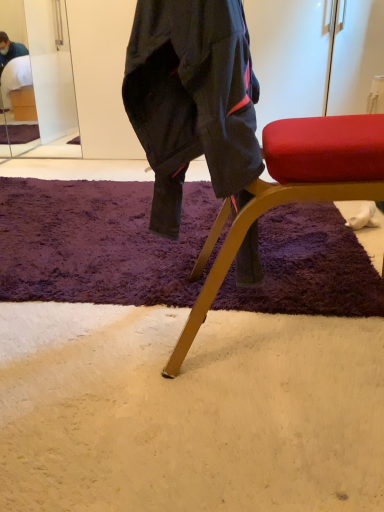
Question: From a real-world perspective, is metallic gold chair at center above or below clear glass mirror at upper left?

Choices:
 (A) below
 (B) above

Answer: (A)

Question: Is point (377, 195) positioned closer to the camera than point (77, 129)?

Choices:
 (A) farther
 (B) closer

Answer: (B)

Question: Which object is positioned closest to the metallic gold chair at center?

Choices:
 (A) clear glass mirror at upper left
 (B) purple shaggy rug at center

Answer: (B)

Question: Estimate the real-world distances between objects in this image. Which object is closer to the clear glass mirror at upper left?

Choices:
 (A) metallic gold chair at center
 (B) purple shaggy rug at center

Answer: (B)